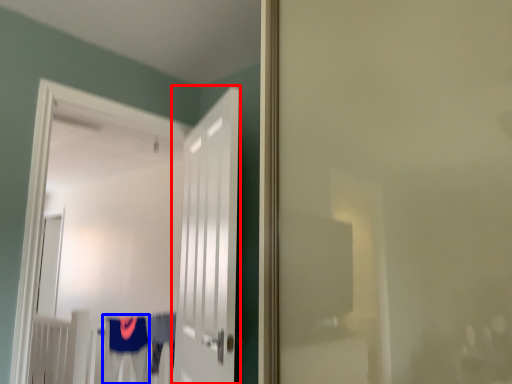
Question: Which point is closer to the camera, door (highlighted by a red box) or robe (highlighted by a blue box)?

Choices:
 (A) door
 (B) robe

Answer: (A)